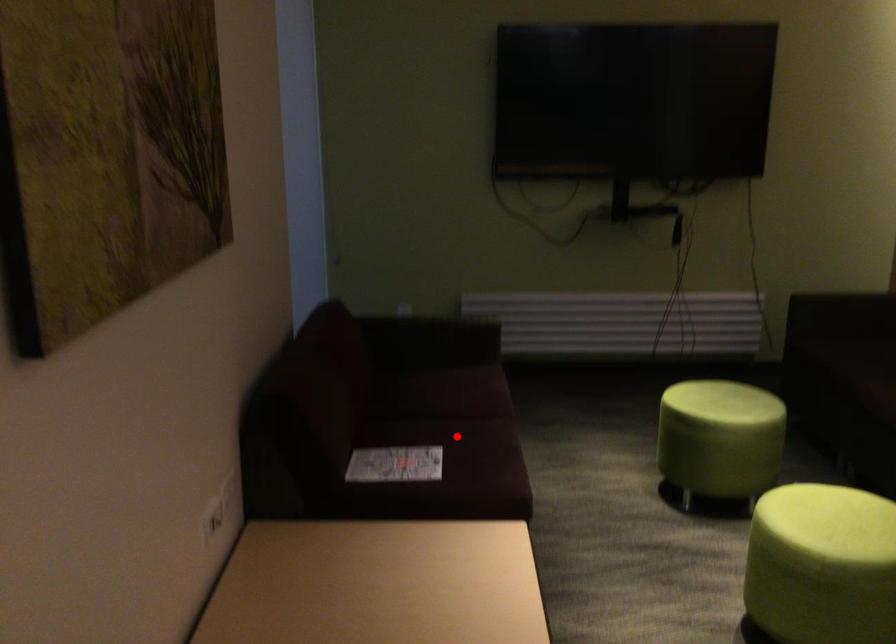
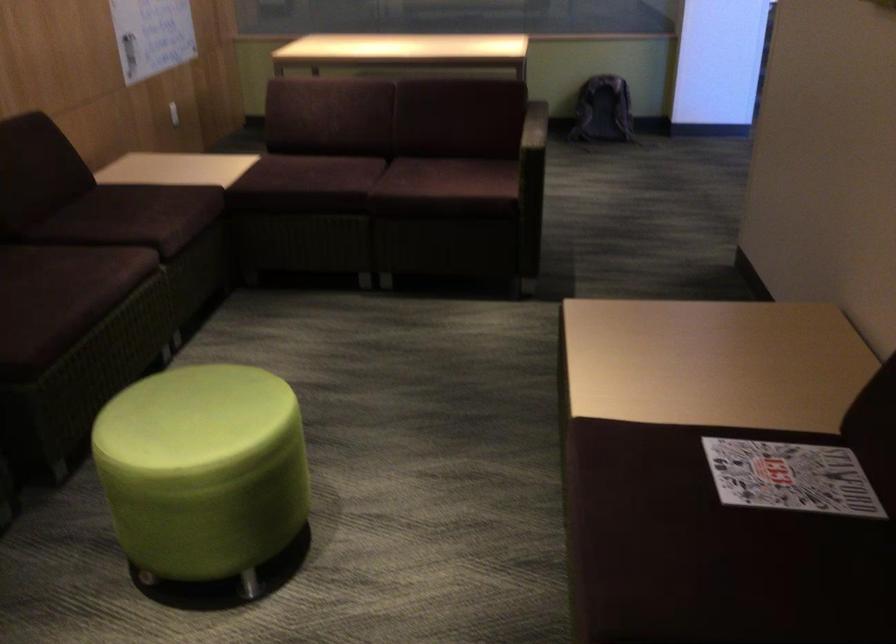
Question: A red point is marked in image1. In image2, is the corresponding 3D point closer to the camera or farther? Reply with the corresponding letter.

Choices:
 (A) The corresponding 3D point is closer.
 (B) The corresponding 3D point is farther.

Answer: (A)